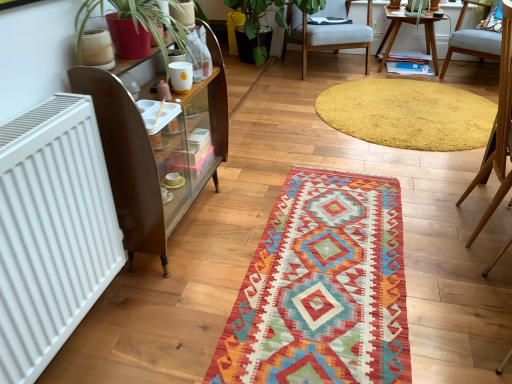
Question: Is brown wooden shelf at left smaller than light blue fabric chair at right, which is the 1th chair from front to back?

Choices:
 (A) yes
 (B) no

Answer: (B)

Question: Considering the relative positions of brown wooden shelf at left and light blue fabric chair at right, which is the third chair from back to front, in the image provided, is brown wooden shelf at left in front of light blue fabric chair at right, which is the third chair from back to front,?

Choices:
 (A) no
 (B) yes

Answer: (B)

Question: Is brown wooden shelf at left oriented away from light blue fabric chair at right, which is the third chair from back to front?

Choices:
 (A) yes
 (B) no

Answer: (B)

Question: From the image's perspective, is brown wooden shelf at left on light blue fabric chair at right, placed as the second chair when sorted from right to left?

Choices:
 (A) yes
 (B) no

Answer: (B)

Question: Is the position of brown wooden shelf at left more distant than that of light blue fabric chair at right, which is the 1th chair from front to back?

Choices:
 (A) no
 (B) yes

Answer: (A)

Question: In the image, is multicolored woven mat at center, the 2th mat positioned from the top, positioned in front of or behind yellow shaggy rug at upper center, the 1th mat viewed from the back?

Choices:
 (A) front
 (B) behind

Answer: (A)

Question: From the image's perspective, relative to yellow shaggy rug at upper center, the second mat when ordered from front to back, is multicolored woven mat at center, placed as the first mat when sorted from bottom to top, above or below?

Choices:
 (A) above
 (B) below

Answer: (B)

Question: Looking at their shapes, would you say multicolored woven mat at center, the first mat when ordered from front to back, is wider or thinner than yellow shaggy rug at upper center, the 1th mat viewed from the back?

Choices:
 (A) thin
 (B) wide

Answer: (A)

Question: Is point (291, 324) closer or farther from the camera than point (479, 102)?

Choices:
 (A) farther
 (B) closer

Answer: (B)

Question: Would you say brown wooden shelf at left is to the left or to the right of wooden table at upper right in the picture?

Choices:
 (A) right
 (B) left

Answer: (B)

Question: Is brown wooden shelf at left wider or thinner than wooden table at upper right?

Choices:
 (A) thin
 (B) wide

Answer: (A)

Question: From a real-world perspective, is brown wooden shelf at left physically located above or below wooden table at upper right?

Choices:
 (A) below
 (B) above

Answer: (B)

Question: Is brown wooden shelf at left taller or shorter than wooden table at upper right?

Choices:
 (A) tall
 (B) short

Answer: (A)

Question: Based on their positions, is wooden table at upper right located to the left or right of brown wooden shelf at left?

Choices:
 (A) right
 (B) left

Answer: (A)

Question: Looking at the image, does wooden table at upper right seem bigger or smaller compared to brown wooden shelf at left?

Choices:
 (A) big
 (B) small

Answer: (B)